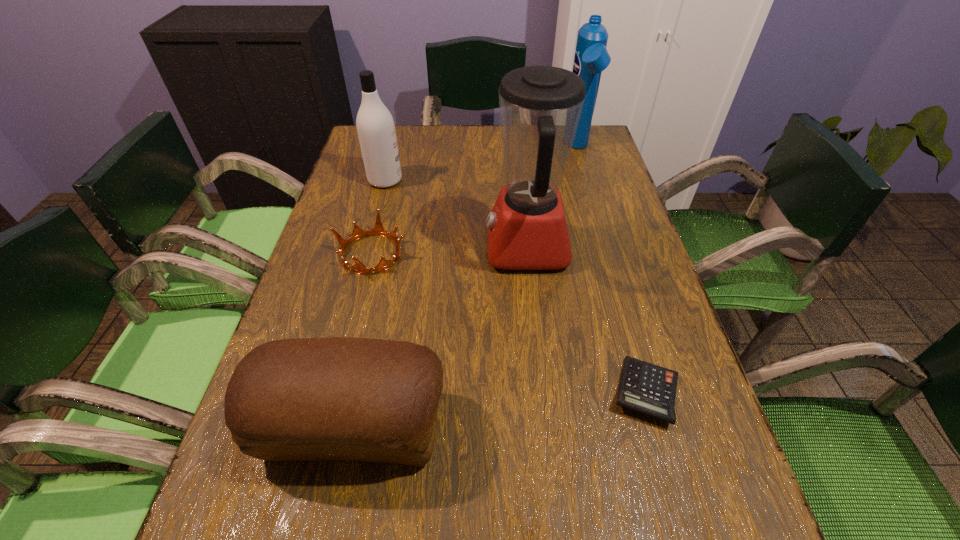
I want to click on vacant space located on the front of the blender near the controls, so click(376, 248).

In order to click on free space located 0.210m on the left of the farther shampoo in this screenshot , I will do `click(497, 148)`.

I want to click on free space located on the front-facing side of the second farthest object, so click(x=537, y=180).

What are the coordinates of `vacant space located on the back of the bread` in the screenshot? It's located at (381, 295).

What are the coordinates of `free space located on the right of the fifth tallest object` in the screenshot? It's located at (527, 254).

The image size is (960, 540). I want to click on vacant area situated 0.070m on the front of the shortest object, so click(x=670, y=475).

The height and width of the screenshot is (540, 960). Find the location of `object located in the far edge section of the desktop`. object located in the far edge section of the desktop is located at coordinates (591, 57).

Image resolution: width=960 pixels, height=540 pixels. I want to click on shampoo that is at the left edge, so click(376, 131).

Identify the location of bread at the left edge. Image resolution: width=960 pixels, height=540 pixels. (339, 398).

This screenshot has height=540, width=960. Identify the location of crown situated at the left edge. (378, 230).